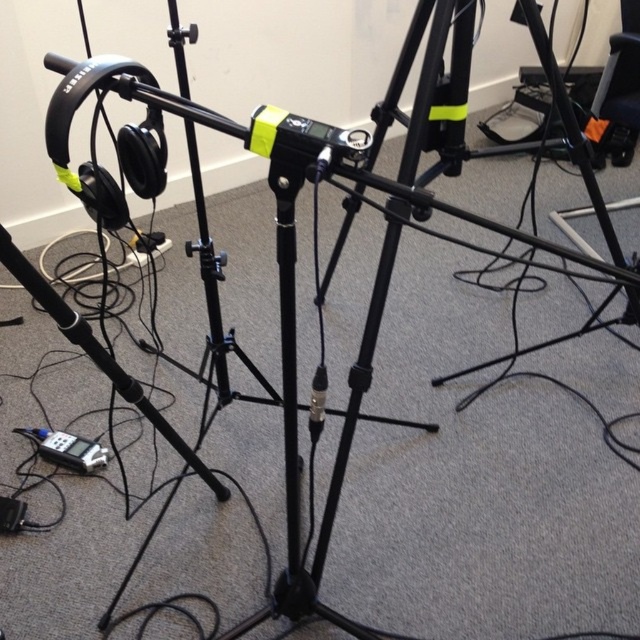
You are setting up a recording studio and need to place the black matte tripod at center and the silver metallic digital device at lower left. Given their sizes, which one requires more space to accommodate?

The black matte tripod at center requires more space because it is bigger than the silver metallic digital device at lower left.

You are setting up a portable recording studio and need to place both the black matte tripod at center and the silver metallic digital device at lower left on a shelf that can only hold items up to 1 meter in width. Based on the scene description, can both items fit side by side on the shelf?

The black matte tripod at center might be wider than silver metallic digital device at lower left, so it is uncertain if both can fit side by side on the shelf without exceeding the 1 meter width limit.

You are setting up a recording studio and need to place a tall speaker that requires 1.2 meters of clearance. Given the black matte tripod at center and the silver metallic digital device at lower left in the scene, which object would allow the speaker to be placed nearby without obstructing the setup?

The black matte tripod at center is much taller than the silver metallic digital device at lower left, so placing the speaker near the silver metallic digital device at lower left would provide sufficient clearance and avoid obstruction.